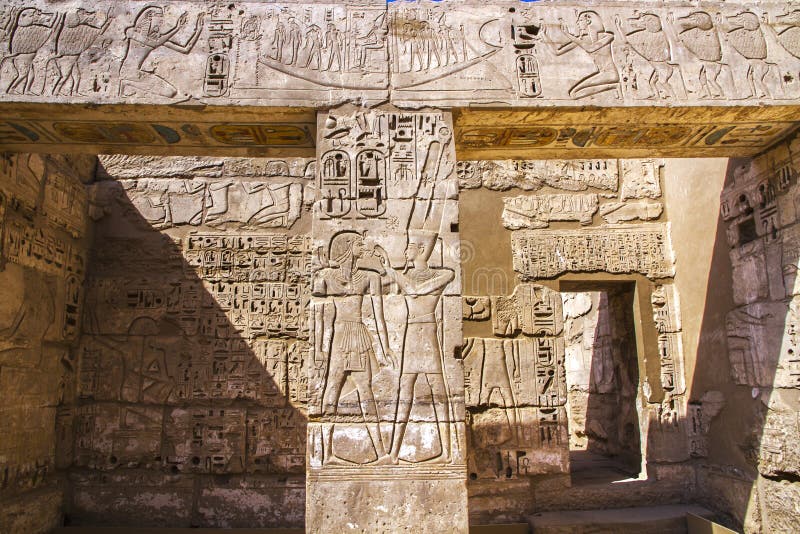
I want to click on doorway, so click(632, 284).